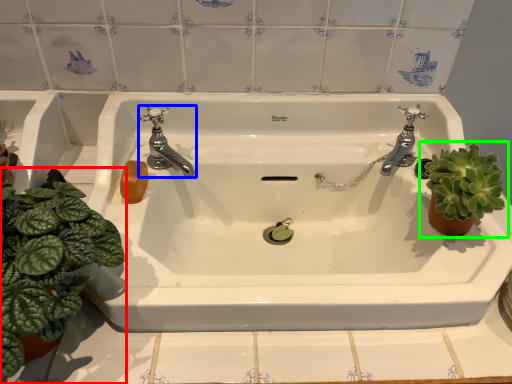
Question: Which is farther away from houseplant (highlighted by a red box)? tap (highlighted by a blue box) or houseplant (highlighted by a green box)?

Choices:
 (A) tap
 (B) houseplant

Answer: (B)